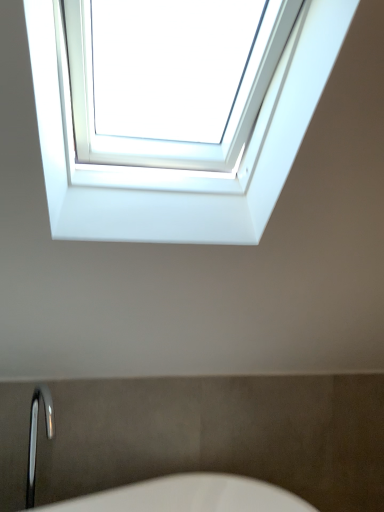
Question: Considering the positions of point (54, 434) and point (216, 241), is point (54, 434) closer or farther from the camera than point (216, 241)?

Choices:
 (A) farther
 (B) closer

Answer: (A)

Question: Do you think polished chrome faucet at lower left is within white plastic window at upper center, or outside of it?

Choices:
 (A) outside
 (B) inside

Answer: (A)

Question: In terms of size, does polished chrome faucet at lower left appear bigger or smaller than white plastic window at upper center?

Choices:
 (A) big
 (B) small

Answer: (B)

Question: From a real-world perspective, is white plastic window at upper center physically located above or below polished chrome faucet at lower left?

Choices:
 (A) below
 (B) above

Answer: (B)

Question: Based on their sizes in the image, would you say white plastic window at upper center is bigger or smaller than polished chrome faucet at lower left?

Choices:
 (A) small
 (B) big

Answer: (B)

Question: In terms of height, does white plastic window at upper center look taller or shorter compared to polished chrome faucet at lower left?

Choices:
 (A) tall
 (B) short

Answer: (A)

Question: Looking at their shapes, would you say white plastic window at upper center is wider or thinner than polished chrome faucet at lower left?

Choices:
 (A) thin
 (B) wide

Answer: (B)